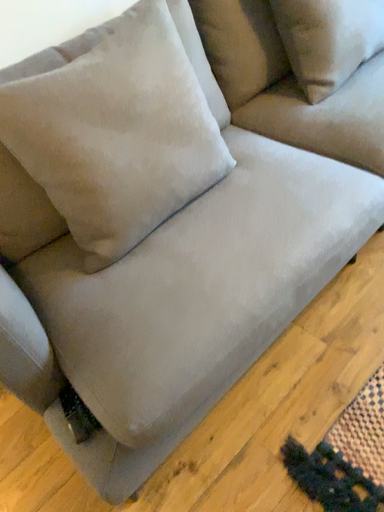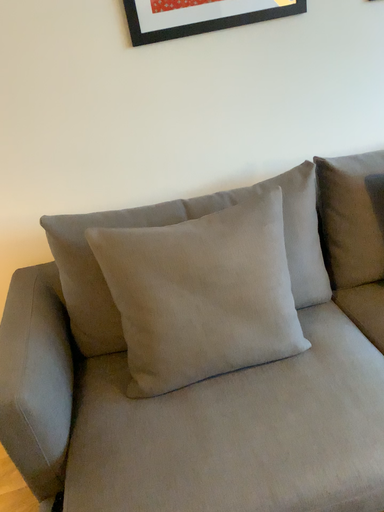
Question: Which way did the camera rotate in the video?

Choices:
 (A) rotated right
 (B) rotated left

Answer: (B)